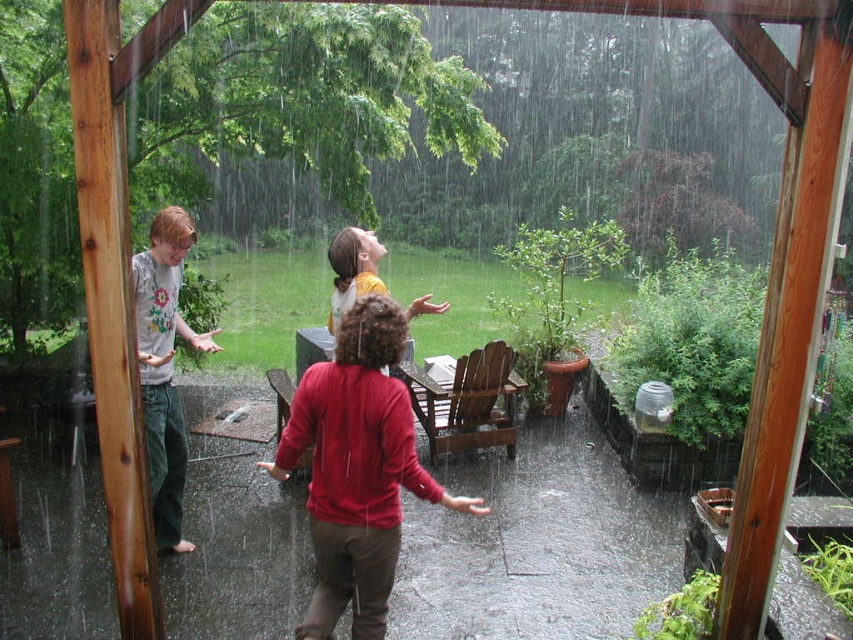
You are standing in the rain and want to hand an umbrella to both the matte red sweater at center and the gray cotton shirt at left. Which person should you approach first to ensure you can reach them without moving from your current position?

You should approach the matte red sweater at center first because they are closer to you than the gray cotton shirt at left, so you can reach them without moving.

You are a photographer trying to capture a group photo of the matte red sweater at center and the gray cotton shirt at left. Based on their positions, which person should you position closer to the camera to ensure both are in focus?

The matte red sweater at center should be positioned closer to the camera since it is wider than the gray cotton shirt at left, ensuring both fit within the frame.